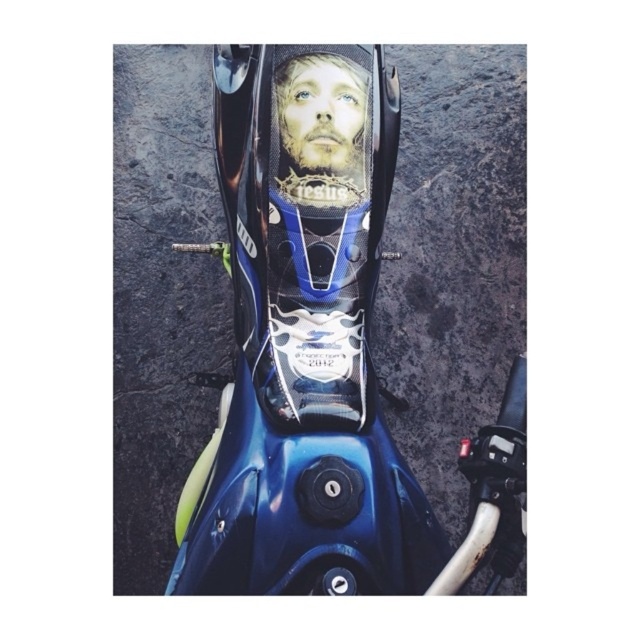
Question: Which point is farther to the camera?

Choices:
 (A) (324, 77)
 (B) (244, 136)

Answer: (B)

Question: Does glossy carbon fiber motorcycle at center lie in front of smooth skin face at center?

Choices:
 (A) yes
 (B) no

Answer: (A)

Question: Does glossy carbon fiber motorcycle at center appear under smooth skin face at center?

Choices:
 (A) no
 (B) yes

Answer: (B)

Question: Which object is farther from the camera taking this photo?

Choices:
 (A) smooth skin face at center
 (B) glossy carbon fiber motorcycle at center

Answer: (A)

Question: Which of the following is the closest to the observer?

Choices:
 (A) smooth skin face at center
 (B) glossy carbon fiber motorcycle at center

Answer: (B)

Question: Is glossy carbon fiber motorcycle at center bigger than smooth skin face at center?

Choices:
 (A) no
 (B) yes

Answer: (B)